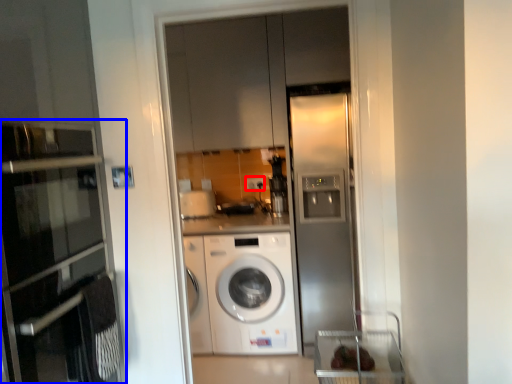
Question: Which point is further to the camera, electric outlet (highlighted by a red box) or oven (highlighted by a blue box)?

Choices:
 (A) electric outlet
 (B) oven

Answer: (A)